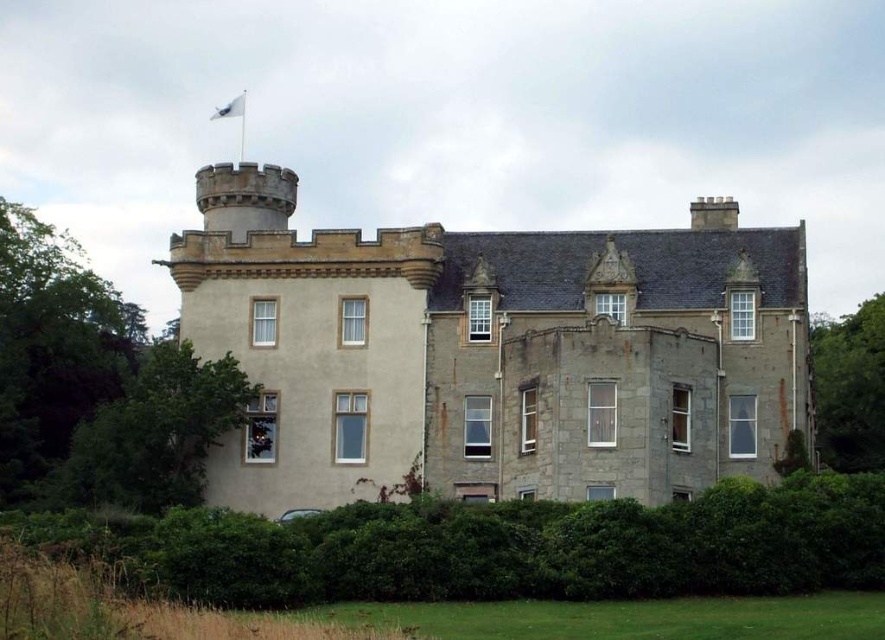
You are a visitor standing in front of the castle and want to take a photo that includes both the green leafy tree at left and the white fabric flag at upper center. Which object will appear larger in the photo?

The green leafy tree at left will appear larger in the photo because it is taller than the white fabric flag at upper center.

You are a visitor standing at the entrance of the historic building. You notice the green leafy hedge at lower center and the white fabric flag at upper center. Which object is taller?

The green leafy hedge at lower center is taller than the white fabric flag at upper center.